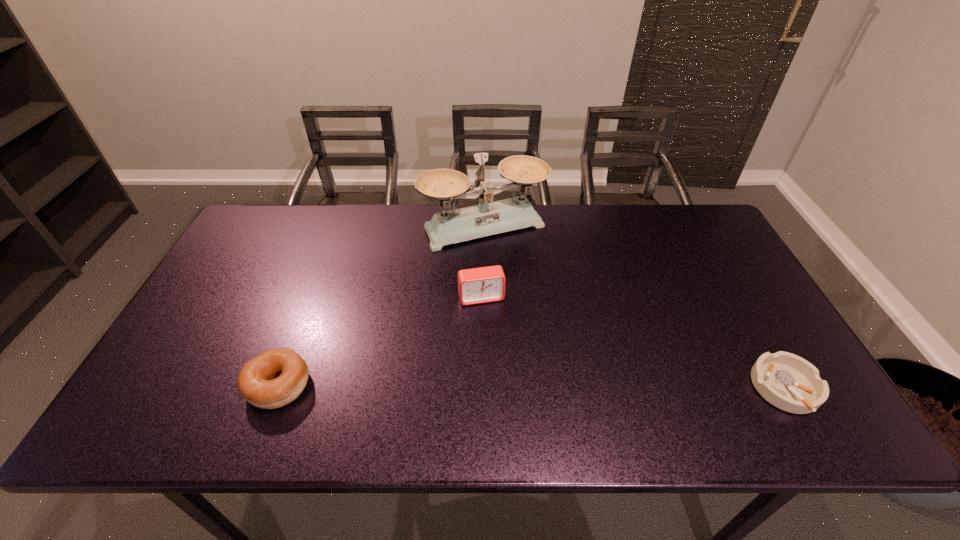
Where is `empty space between the shortest object and the alarm clock`? The width and height of the screenshot is (960, 540). empty space between the shortest object and the alarm clock is located at coordinates (634, 343).

Where is `vacant area that lies between the leftmost object and the alarm clock`? The image size is (960, 540). vacant area that lies between the leftmost object and the alarm clock is located at coordinates (380, 341).

Where is `free spot between the alarm clock and the ashtray`? Image resolution: width=960 pixels, height=540 pixels. free spot between the alarm clock and the ashtray is located at coordinates (634, 343).

The height and width of the screenshot is (540, 960). Identify the location of free space that is in between the leftmost object and the farthest object. (381, 306).

I want to click on vacant area between the rightmost object and the bagel, so click(x=532, y=387).

Locate an element on the screen. vacant point located between the scale and the third shortest object is located at coordinates (483, 262).

Locate an element on the screen. This screenshot has width=960, height=540. free spot between the third tallest object and the farthest object is located at coordinates (381, 306).

Locate an element on the screen. free space that is in between the ashtray and the second tallest object is located at coordinates (634, 343).

Identify which object is the third nearest to the tallest object. Please provide its 2D coordinates. Your answer should be formatted as a tuple, i.e. [(x, y)], where the tuple contains the x and y coordinates of a point satisfying the conditions above.

[(787, 381)]

Select which object is the closest to the rightmost object. Please provide its 2D coordinates. Your answer should be formatted as a tuple, i.e. [(x, y)], where the tuple contains the x and y coordinates of a point satisfying the conditions above.

[(488, 218)]